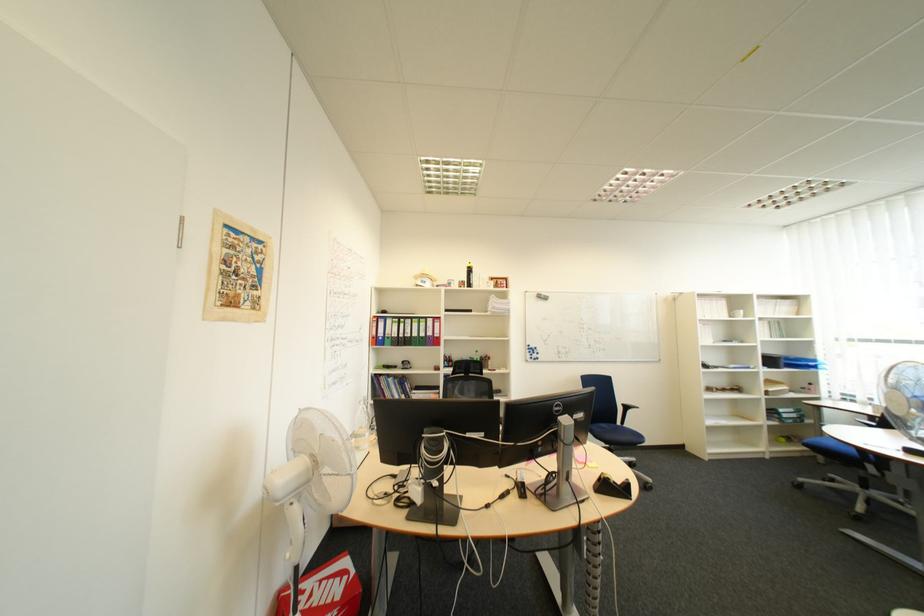
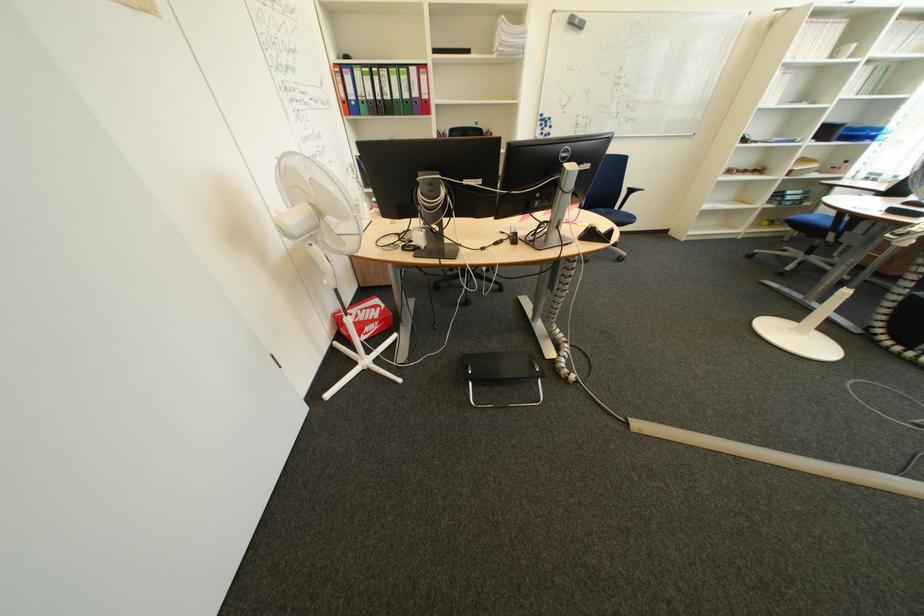
Where in the second image is the point corresponding to point 784,363 from the first image?

(840, 132)